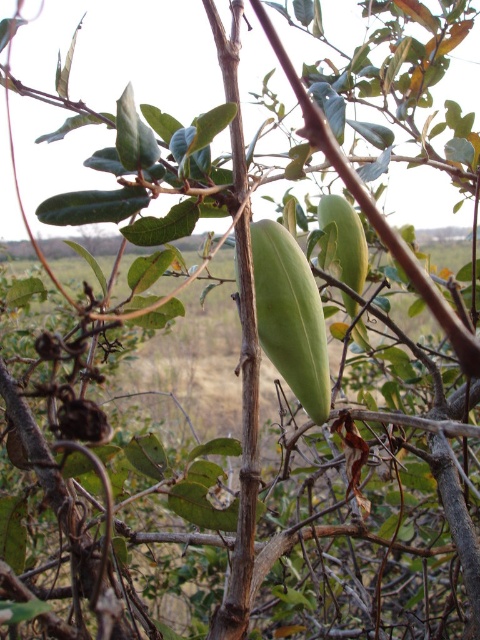
You are a botanist examining the plant and notice two items at the center. Which one is nearer to you, the green matte pod at center or the green matte fruit at center?

The green matte pod at center is closer to the viewer than the green matte fruit at center.

You are a botanist examining the plant and need to measure the distance between you and the green matte pod at center. Based on the scene, can you estimate how far it is?

The green matte pod at center is 36.12 inches away from viewer, so the distance is approximately 36.12 inches.

You are a botanist examining the plant in the image. You notice two green matte items at the center. Which one is located lower between the green matte pod at center and the green matte fruit at center?

The green matte pod at center is located below the green matte fruit at center.